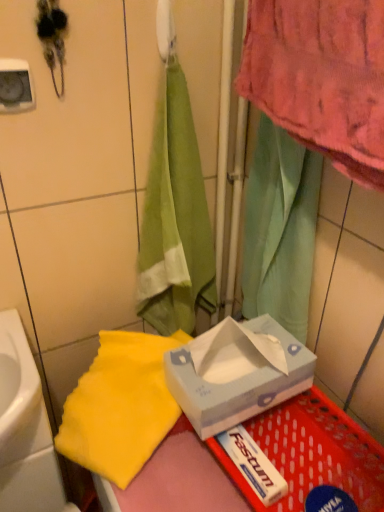
Describe the element at coordinates (19, 394) in the screenshot. I see `white glossy sink at lower left` at that location.

In order to face white plastic basket at lower right, should I rotate leftwards or rightwards?

To face it directly, rotate right by 9.363 degrees.

Measure the distance between point (247, 342) and camera.

Point (247, 342) and camera are 83.00 centimeters apart.

I want to click on yellow fabric towel at lower left, so click(x=120, y=406).

Identify the location of white glossy sink at lower left. Image resolution: width=384 pixels, height=512 pixels. (19, 394).

Is yellow fabric towel at lower left to the left of white glossy sink at lower left from the viewer's perspective?

No.

Is yellow fabric towel at lower left not close to white glossy sink at lower left?

No.

Is point (124, 371) closer to viewer compared to point (13, 412)?

No, (124, 371) is behind (13, 412).

You are a GUI agent. You are given a task and a screenshot of the screen. Output one action in this format:
    pyautogui.click(x=<x>, y=<y>)
    Task: Click on the beach towel above the white glossy sink at lower left (from the image's perspective)
    
    Given the screenshot: What is the action you would take?
    pyautogui.click(x=120, y=406)

Measure the distance between white paper tissue box at center and white plastic basket at lower right.

4.12 inches.

Considering the relative positions of white paper tissue box at center and white plastic basket at lower right in the image provided, is white paper tissue box at center to the left of white plastic basket at lower right from the viewer's perspective?

Yes.

From a real-world perspective, is white paper tissue box at center physically above white plastic basket at lower right?

Indeed, from a real-world perspective, white paper tissue box at center stands above white plastic basket at lower right.

Is white paper tissue box at center bigger than white plastic basket at lower right?

Yes.

From the image's perspective, which one is positioned higher, white paper tissue box at center or white glossy sink at lower left?

From the image's view, white paper tissue box at center is above.

Between white paper tissue box at center and white glossy sink at lower left, which one has more height?

Standing taller between the two is white glossy sink at lower left.

Considering the points (219, 373) and (26, 386), which point is in front, point (219, 373) or point (26, 386)?

The point (26, 386) is in front.

Which is more to the right, white paper tissue box at center or white glossy sink at lower left?

white paper tissue box at center is more to the right.

Between white plastic basket at lower right and yellow fabric towel at lower left, which one appears on the left side from the viewer's perspective?

yellow fabric towel at lower left.

Is white plastic basket at lower right bigger or smaller than yellow fabric towel at lower left?

Clearly, white plastic basket at lower right is smaller in size than yellow fabric towel at lower left.

Which object is thinner, white plastic basket at lower right or yellow fabric towel at lower left?

Thinner between the two is yellow fabric towel at lower left.

From the image's perspective, is white glossy sink at lower left above yellow fabric towel at lower left?

No, from the image's perspective, white glossy sink at lower left is not on top of yellow fabric towel at lower left.

Is white glossy sink at lower left positioned behind yellow fabric towel at lower left?

Yes, white glossy sink at lower left is further from the viewer.

How far apart are white glossy sink at lower left and yellow fabric towel at lower left?

5.47 inches.

Is point (19, 450) positioned behind point (113, 459)?

Yes.

At what (x,y) coordinates should I click in order to perform the action: click on beach towel that is behind the white paper tissue box at center. Please return your answer as a coordinate pair (x, y). Looking at the image, I should click on [120, 406].

Considering the sizes of objects yellow fabric towel at lower left and white paper tissue box at center in the image provided, who is smaller, yellow fabric towel at lower left or white paper tissue box at center?

white paper tissue box at center is smaller.

Considering the relative positions of yellow fabric towel at lower left and white paper tissue box at center in the image provided, is yellow fabric towel at lower left to the left or to the right of white paper tissue box at center?

Based on their positions, yellow fabric towel at lower left is located to the left of white paper tissue box at center.

Is point (88, 452) farther from camera compared to point (275, 384)?

Yes, it is.

Is point (1, 357) less distant than point (202, 429)?

No, (1, 357) is behind (202, 429).

Would you say white glossy sink at lower left is a long distance from white paper tissue box at center?

No, there isn't a large distance between white glossy sink at lower left and white paper tissue box at center.

Which object is positioned more to the left, white glossy sink at lower left or white paper tissue box at center?

white glossy sink at lower left is more to the left.

Who is taller, white glossy sink at lower left or white paper tissue box at center?

white glossy sink at lower left is taller.

Find the location of a particular element. This screenshot has width=384, height=512. beach towel that is above the white glossy sink at lower left (from a real-world perspective) is located at coordinates (120, 406).

The width and height of the screenshot is (384, 512). I want to click on basket below the white paper tissue box at center (from a real-world perspective), so click(x=313, y=453).

When comparing their distances from white plastic basket at lower right, does white glossy sink at lower left or white paper tissue box at center seem further?

Based on the image, white glossy sink at lower left appears to be further to white plastic basket at lower right.

Estimate the real-world distances between objects in this image. Which object is further from white glossy sink at lower left, yellow fabric towel at lower left or white plastic basket at lower right?

white plastic basket at lower right.

When comparing their distances from white paper tissue box at center, does white plastic basket at lower right or yellow fabric towel at lower left seem further?

yellow fabric towel at lower left is positioned further to the anchor white paper tissue box at center.

When comparing their distances from white glossy sink at lower left, does white plastic basket at lower right or yellow fabric towel at lower left seem closer?

yellow fabric towel at lower left is positioned closer to the anchor white glossy sink at lower left.

Estimate the real-world distances between objects in this image. Which object is closer to yellow fabric towel at lower left, white paper tissue box at center or white glossy sink at lower left?

white paper tissue box at center.

Looking at the image, which one is located further to white plastic basket at lower right, white glossy sink at lower left or yellow fabric towel at lower left?

The object further to white plastic basket at lower right is white glossy sink at lower left.

Based on their spatial positions, is white glossy sink at lower left or yellow fabric towel at lower left closer to white paper tissue box at center?

Based on the image, yellow fabric towel at lower left appears to be nearer to white paper tissue box at center.

When comparing their distances from white plastic basket at lower right, does white paper tissue box at center or white glossy sink at lower left seem closer?

white paper tissue box at center.

The width and height of the screenshot is (384, 512). I want to click on box between yellow fabric towel at lower left and white plastic basket at lower right from left to right, so click(237, 373).

Identify the location of beach towel situated between white glossy sink at lower left and white plastic basket at lower right from left to right. (120, 406).

Identify the location of box between white glossy sink at lower left and white plastic basket at lower right in the horizontal direction. (237, 373).

I want to click on beach towel located between white glossy sink at lower left and white paper tissue box at center in the left-right direction, so click(120, 406).